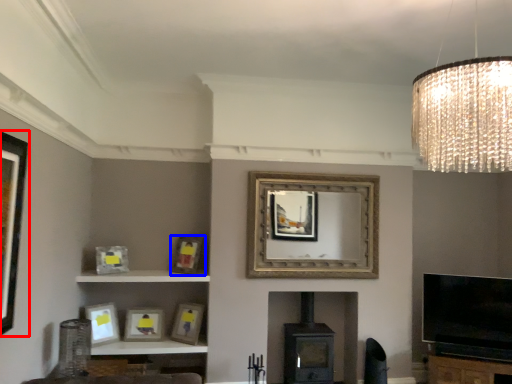
Question: Among these objects, which one is farthest to the camera, picture frame (highlighted by a red box) or picture frame (highlighted by a blue box)?

Choices:
 (A) picture frame
 (B) picture frame

Answer: (B)